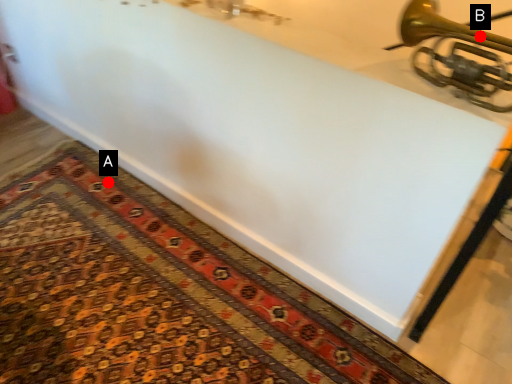
Question: Two points are circled on the image, labeled by A and B beside each circle. Which point is farther to the camera?

Choices:
 (A) A is further
 (B) B is further

Answer: (A)